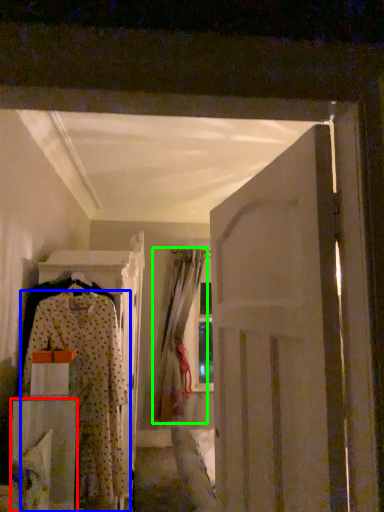
Question: Which object is the farthest from furniture (highlighted by a red box)? Choose among these: fancy dress (highlighted by a blue box) or curtain (highlighted by a green box).

Choices:
 (A) fancy dress
 (B) curtain

Answer: (B)